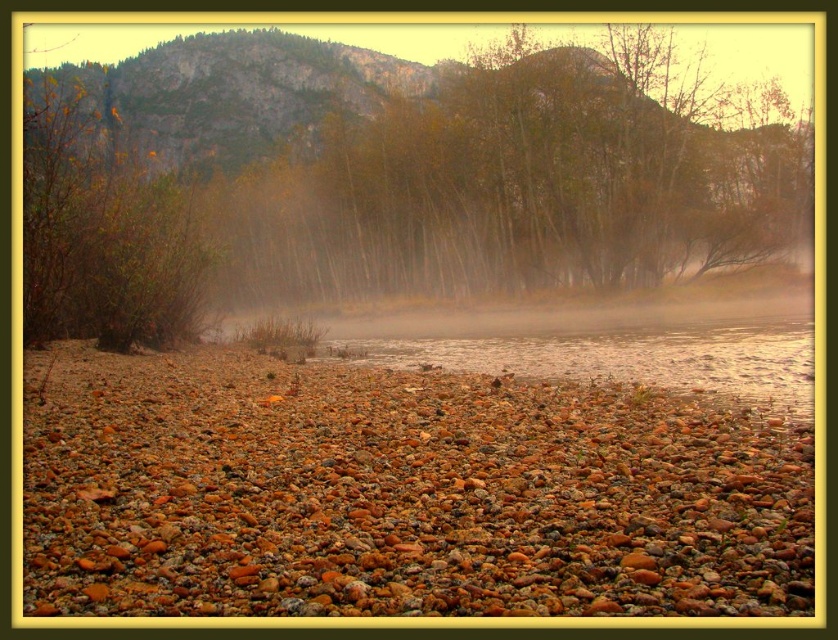
You are standing on the pebbled riverbank and see the point marked at coordinates (401,492). What can you observe at that location?

At the coordinates (401,492), there are multicolored pebbles at center.

You are standing on the riverbank and want to take a photo of the multicolored pebbles at center and the brown textured trees at center. Which object is closer to you, the photographer?

The multicolored pebbles at center are closer to you because they are positioned in front of the brown textured trees at center.

You are a hiker who wants to cross the river using the pebbles. The trees are blocking your path. Can you walk around the brown textured trees at center to reach the multicolored pebbles at center?

The multicolored pebbles at center is positioned on the left side of brown textured trees at center, so you can walk around the right side of the brown textured trees at center to reach the multicolored pebbles at center.